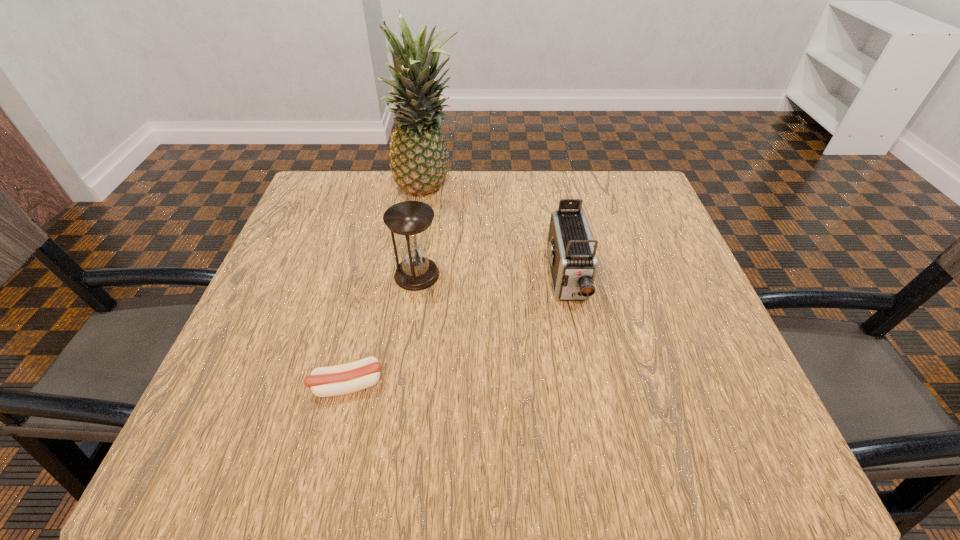
Identify the location of the tallest object. (x=418, y=152).

Locate an element on the screen. This screenshot has width=960, height=540. the farthest object is located at coordinates (418, 152).

The height and width of the screenshot is (540, 960). Find the location of `hourglass`. hourglass is located at coordinates (409, 220).

Identify the location of the rightmost object. The image size is (960, 540). (573, 262).

Locate an element on the screen. sausage is located at coordinates (351, 377).

You are a GUI agent. You are given a task and a screenshot of the screen. Output one action in this format:
    pyautogui.click(x=<x>, y=<y>)
    Task: Click on the shortest object
    
    Given the screenshot: What is the action you would take?
    pyautogui.click(x=351, y=377)

You are a GUI agent. You are given a task and a screenshot of the screen. Output one action in this format:
    pyautogui.click(x=<x>, y=<y>)
    Task: Click on the blank space located on the left of the pineapple
    This screenshot has height=540, width=960.
    Given the screenshot: What is the action you would take?
    pyautogui.click(x=347, y=191)

At what (x,y) coordinates should I click in order to perform the action: click on free point located on the left of the hourglass. Please return your answer as a coordinate pair (x, y). Looking at the image, I should click on tap(287, 274).

Locate an element on the screen. vacant space located at the lens of the rightmost object is located at coordinates (582, 354).

The width and height of the screenshot is (960, 540). Identify the location of vacant space located on the right of the shortest object. (430, 384).